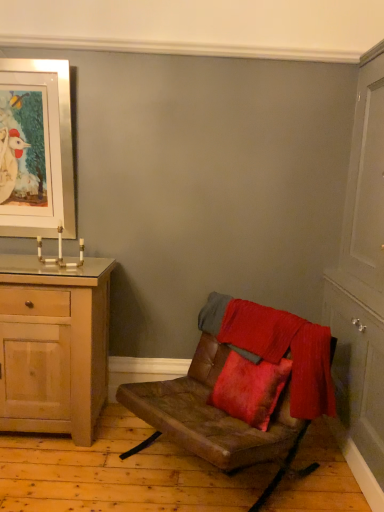
Question: Should I look upward or downward to see light wood cabinet at left?

Choices:
 (A) up
 (B) down

Answer: (B)

Question: From the image's perspective, is leather cushion at center on top of white wood cabinet at right?

Choices:
 (A) yes
 (B) no

Answer: (B)

Question: Would you say leather cushion at center is a long distance from white wood cabinet at right?

Choices:
 (A) no
 (B) yes

Answer: (A)

Question: From the image's perspective, is leather cushion at center under white wood cabinet at right?

Choices:
 (A) no
 (B) yes

Answer: (B)

Question: Can you confirm if leather cushion at center is positioned to the right of white wood cabinet at right?

Choices:
 (A) no
 (B) yes

Answer: (A)

Question: Considering the relative sizes of leather cushion at center and white wood cabinet at right in the image provided, is leather cushion at center shorter than white wood cabinet at right?

Choices:
 (A) no
 (B) yes

Answer: (B)

Question: Is leather cushion at center bigger than white wood cabinet at right?

Choices:
 (A) no
 (B) yes

Answer: (A)

Question: Is leather cushion at center smaller than silver metallic picture frame at upper left?

Choices:
 (A) no
 (B) yes

Answer: (A)

Question: Does leather cushion at center lie in front of silver metallic picture frame at upper left?

Choices:
 (A) no
 (B) yes

Answer: (B)

Question: Is leather cushion at center not within silver metallic picture frame at upper left?

Choices:
 (A) yes
 (B) no

Answer: (A)

Question: From a real-world perspective, is leather cushion at center over silver metallic picture frame at upper left?

Choices:
 (A) yes
 (B) no

Answer: (B)

Question: Is leather cushion at center facing away from silver metallic picture frame at upper left?

Choices:
 (A) no
 (B) yes

Answer: (A)

Question: Is leather cushion at center oriented towards silver metallic picture frame at upper left?

Choices:
 (A) no
 (B) yes

Answer: (A)

Question: Can you confirm if silver metallic picture frame at upper left is wider than white wood cabinet at right?

Choices:
 (A) no
 (B) yes

Answer: (A)